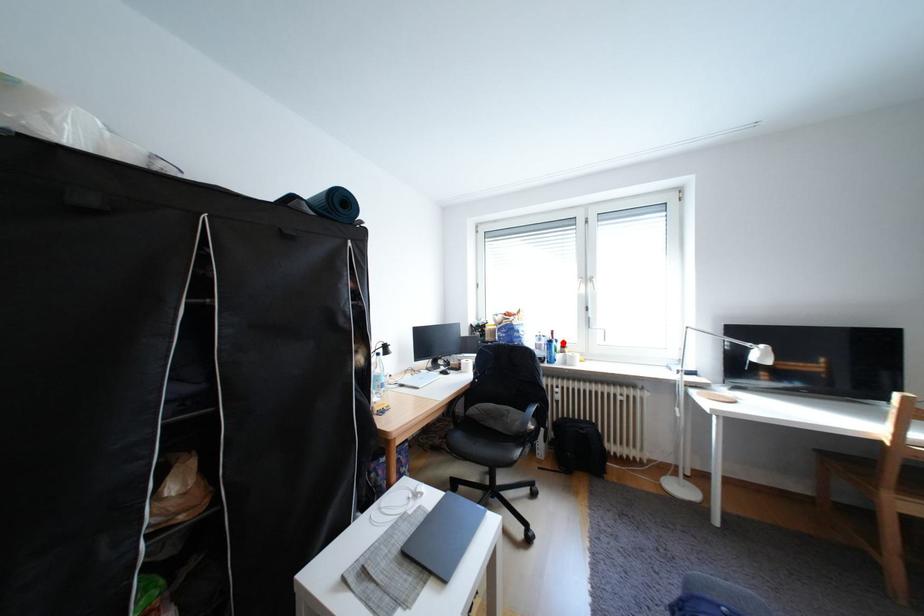
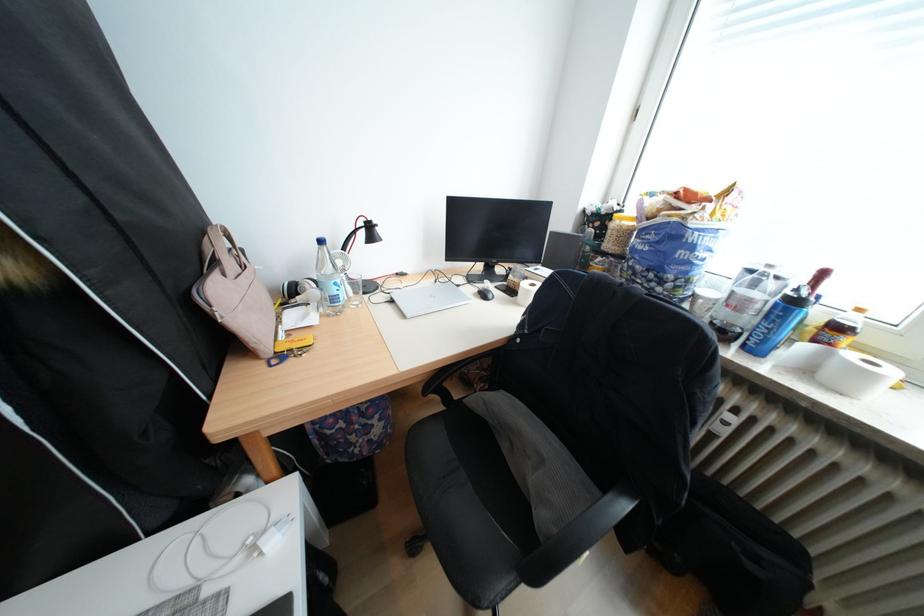
The point at the highlighted location is marked in the first image. Where is the corresponding point in the second image?

(808, 302)